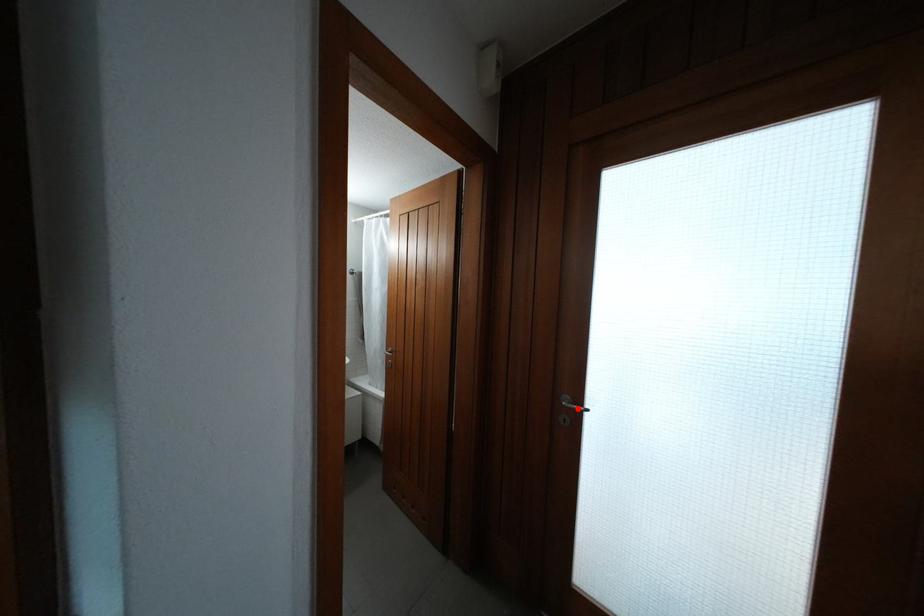
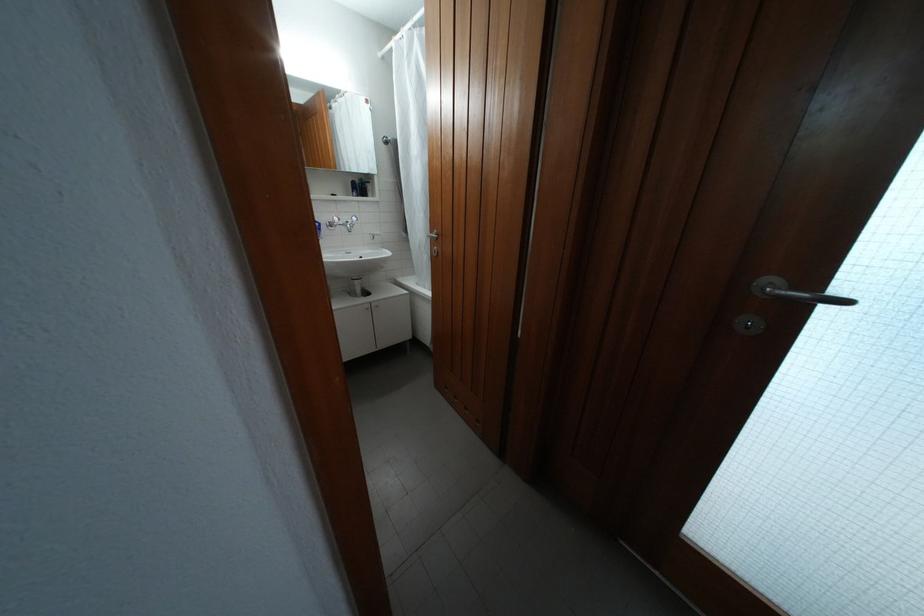
In the second image, find the point that corresponds to the highlighted location in the first image.

(791, 294)